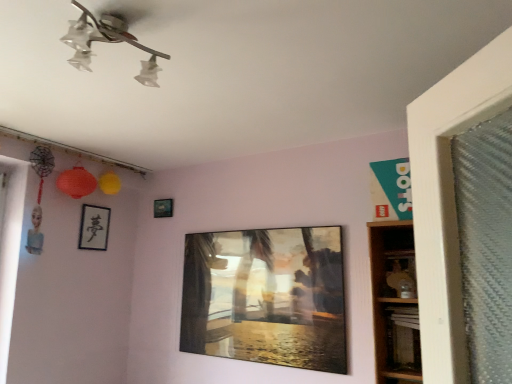
Question: From the image's perspective, is wooden at right, which is the second shelf from top to bottom, positioned above or below black matte picture frame at upper left, marked as the second picture frame in a front-to-back arrangement?

Choices:
 (A) below
 (B) above

Answer: (A)

Question: Considering their positions, is wooden at right, acting as the first shelf starting from the bottom, located in front of or behind black matte picture frame at upper left, the 2th picture frame viewed from the back?

Choices:
 (A) behind
 (B) front

Answer: (B)

Question: Which of these objects is positioned farthest from the black matte picture frame at upper left, which is counted as the first picture frame, starting from the left?

Choices:
 (A) wooden at right, which is the second shelf from top to bottom
 (B) clear glass light fixture at upper center
 (C) metallic silver picture frame at upper center, placed as the 1th picture frame when sorted from back to front
 (D) metallic glass painting at center, the 3th picture frame in the left-to-right sequence
 (E) wooden shelf at right, the 2th shelf when ordered from bottom to top

Answer: (E)

Question: Considering the real-world distances, which object is farthest from the black matte picture frame at upper left, marked as the second picture frame in a front-to-back arrangement?

Choices:
 (A) wooden shelf at right, the 2th shelf when ordered from bottom to top
 (B) metallic silver picture frame at upper center, placed as the second picture frame when sorted from right to left
 (C) clear glass light fixture at upper center
 (D) metallic glass painting at center, the 1th picture frame viewed from the right
 (E) wooden at right, acting as the first shelf starting from the bottom

Answer: (A)